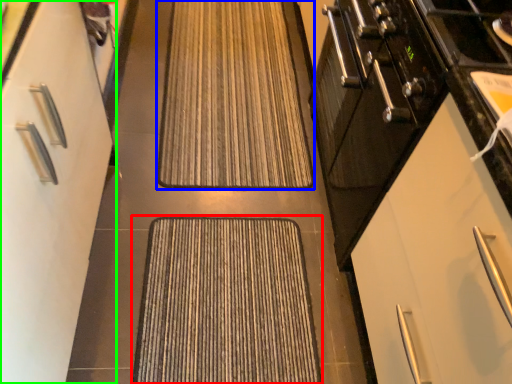
Question: Which is nearer to the doormat (highlighted by a red box)? doormat (highlighted by a blue box) or cabinetry (highlighted by a green box).

Choices:
 (A) doormat
 (B) cabinetry

Answer: (B)